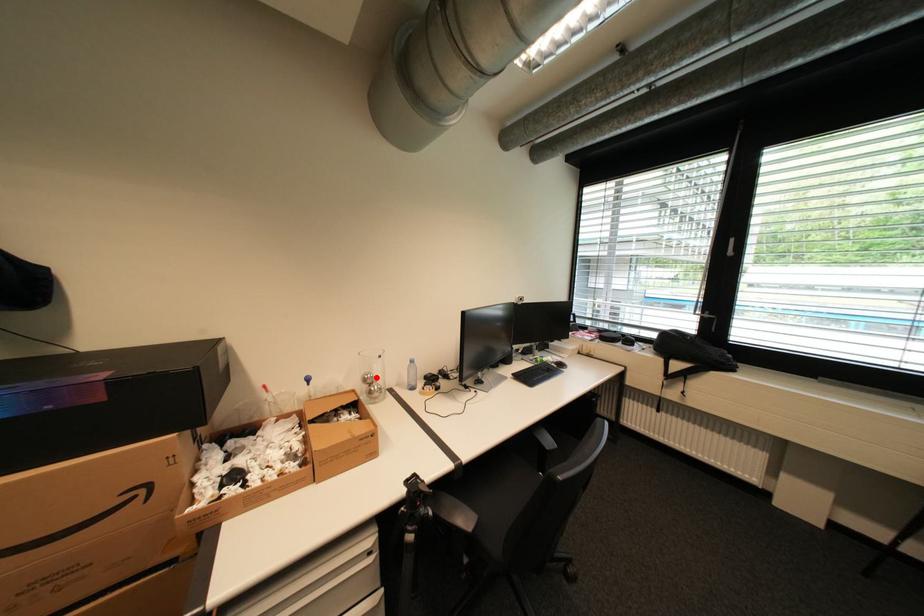
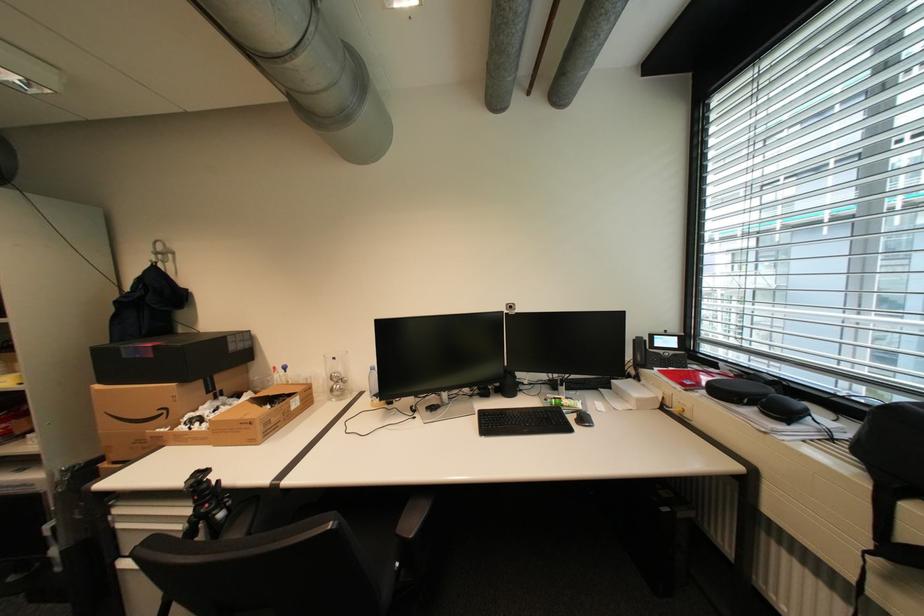
Question: I am providing you with two images of the same scene from different viewpoints. A red point is marked on the first image. At the location where the point appears in image 1, is it still visible in image 2?

Choices:
 (A) Yes
 (B) No

Answer: (A)